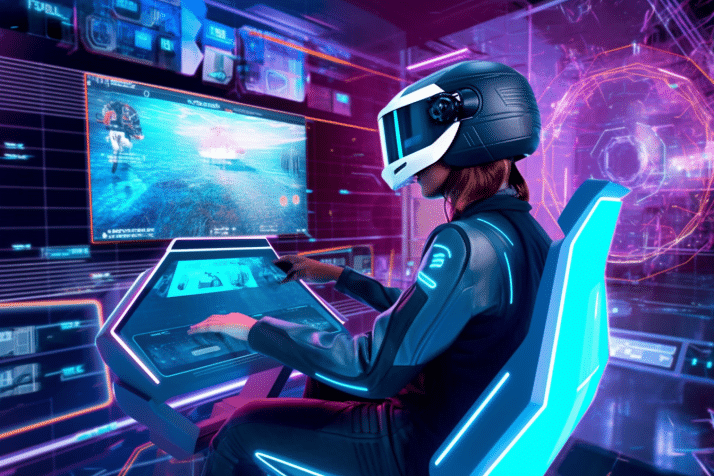
The width and height of the screenshot is (714, 476). What are the coordinates of `chair` in the screenshot? It's located at (572, 343).